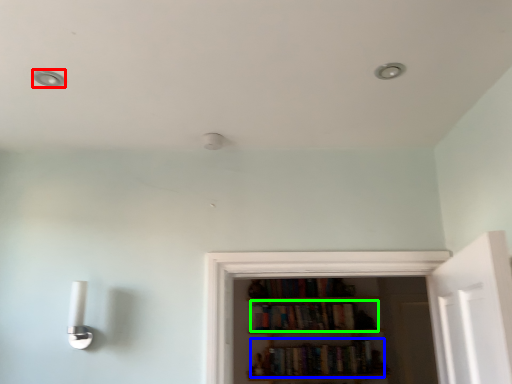
Question: Which object is positioned farthest from dot (highlighted by a red box)? Select from book (highlighted by a blue box) and book (highlighted by a green box).

Choices:
 (A) book
 (B) book

Answer: (A)